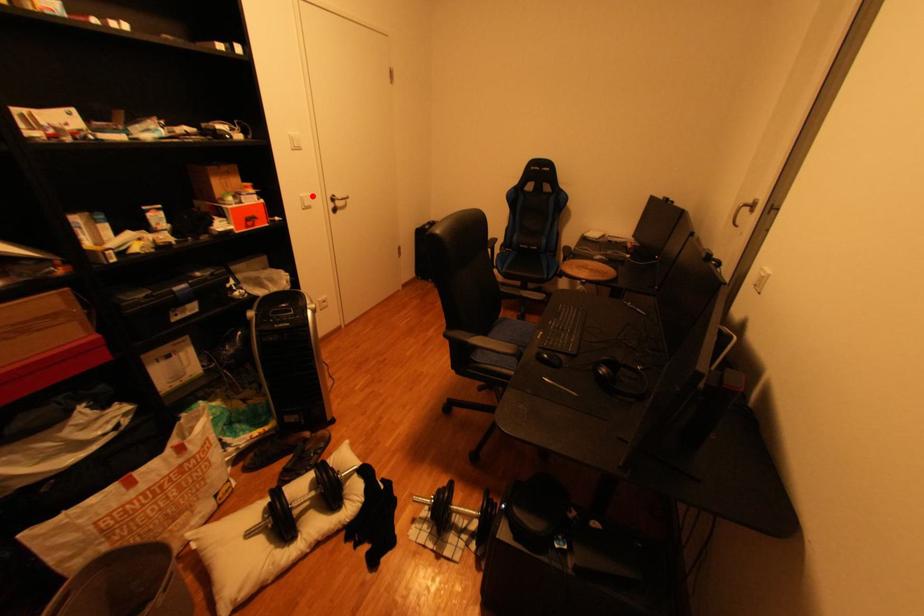
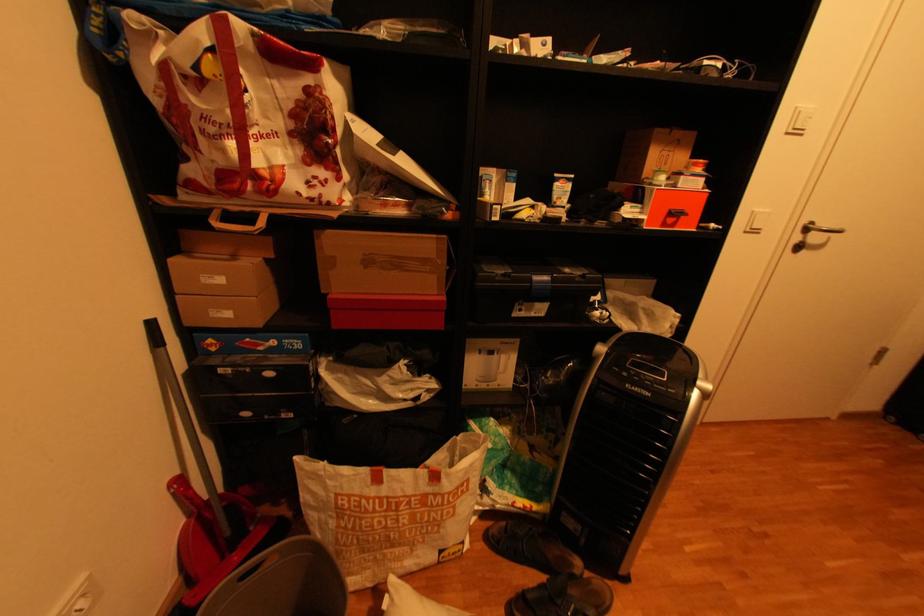
In the second image, find the point that corresponds to the highlighted location in the first image.

(766, 209)